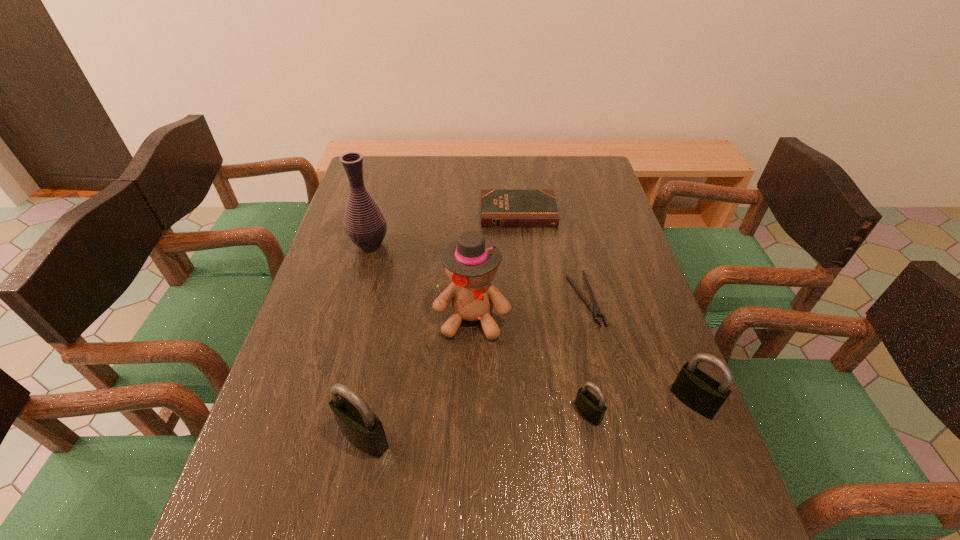
Where is `vase present at the left edge`? The height and width of the screenshot is (540, 960). vase present at the left edge is located at coordinates (365, 224).

What are the coordinates of `padlock present at the right edge` in the screenshot? It's located at (700, 392).

At what (x,y) coordinates should I click in order to perform the action: click on tongs located in the right edge section of the desktop. Please return your answer as a coordinate pair (x, y). Image resolution: width=960 pixels, height=540 pixels. Looking at the image, I should click on (596, 311).

Locate an element on the screen. Image resolution: width=960 pixels, height=540 pixels. object at the near left corner is located at coordinates (360, 426).

Locate an element on the screen. vacant space at the far edge of the desktop is located at coordinates (517, 166).

Where is `free spot at the left edge of the desktop`? The height and width of the screenshot is (540, 960). free spot at the left edge of the desktop is located at coordinates (309, 297).

This screenshot has width=960, height=540. I want to click on free region at the right edge, so click(598, 248).

Image resolution: width=960 pixels, height=540 pixels. I want to click on vacant point at the far left corner, so click(x=373, y=181).

In the image, there is a desktop. Identify the location of vacant space at the near left corner. This screenshot has width=960, height=540. (284, 456).

Locate an element on the screen. This screenshot has width=960, height=540. vacant space at the far right corner of the desktop is located at coordinates (560, 160).